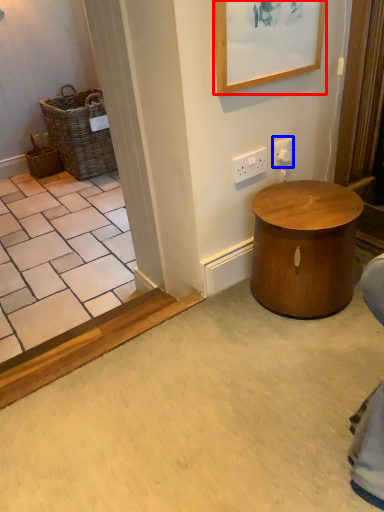
Question: Which object is further to the camera taking this photo, picture frame (highlighted by a red box) or electric outlet (highlighted by a blue box)?

Choices:
 (A) picture frame
 (B) electric outlet

Answer: (B)